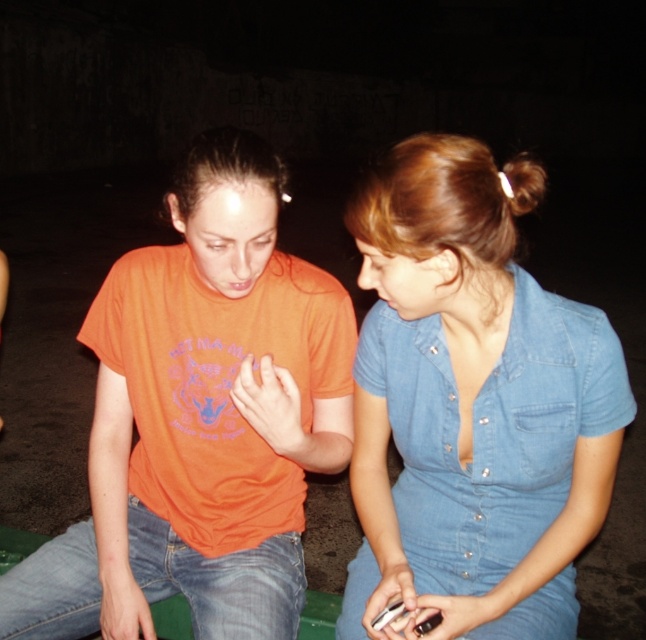
You are a photographer setting up for a group photo. You have two subjects wearing the orange cotton shirt at center and the denim dress at center. To ensure both are visible in the frame, which clothing item should you position closer to the camera?

The orange cotton shirt at center is taller than the denim dress at center, so you should position the orange cotton shirt at center closer to the camera to ensure both are visible in the frame.

You are a photographer trying to capture a candid shot of the two people in the scene. Your camera has a maximum focus range of 12 inches. Can you take a photo that includes both the orange cotton shirt at center and the denim dress at center without moving the camera?

The distance between the orange cotton shirt at center and the denim dress at center is 10.06 inches, which is within the camera focus range of 12 inches. Therefore, you can take a photo that includes both without moving the camera.

You are a photographer trying to capture a closeup shot of the person on the right. You notice two points in the image at coordinates point [251,522] and point [488,550]. Which point should you focus on to ensure the person on the right is in sharp focus?

Point [251,522] is further to the viewer than point [488,550]. Therefore, focusing on point [251,522] would ensure the person on the right is in sharp focus.